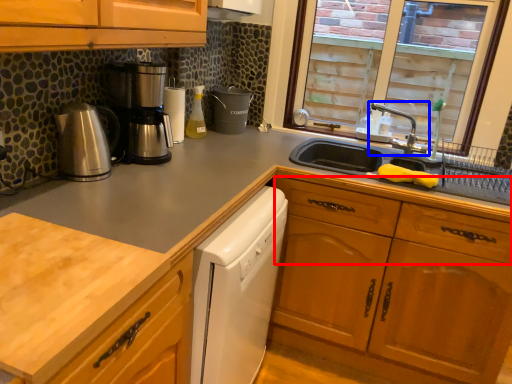
Question: Which of the following is the farthest to the observer, drawer (highlighted by a red box) or tap (highlighted by a blue box)?

Choices:
 (A) drawer
 (B) tap

Answer: (B)